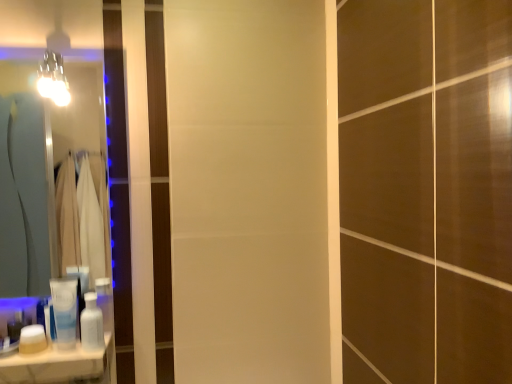
Question: Considering the relative sizes of white matte jar at lower left, marked as the first toiletry in a left-to-right arrangement, and metallic glass light fixture at upper left in the image provided, is white matte jar at lower left, marked as the first toiletry in a left-to-right arrangement, wider than metallic glass light fixture at upper left?

Choices:
 (A) no
 (B) yes

Answer: (A)

Question: Does white matte jar at lower left, marked as the first toiletry in a left-to-right arrangement, have a lesser width compared to metallic glass light fixture at upper left?

Choices:
 (A) yes
 (B) no

Answer: (A)

Question: Is white matte jar at lower left, marked as the first toiletry in a left-to-right arrangement, bigger than metallic glass light fixture at upper left?

Choices:
 (A) yes
 (B) no

Answer: (B)

Question: Considering the relative positions of white matte jar at lower left, positioned as the third toiletry in right-to-left order, and metallic glass light fixture at upper left in the image provided, is white matte jar at lower left, positioned as the third toiletry in right-to-left order, in front of metallic glass light fixture at upper left?

Choices:
 (A) yes
 (B) no

Answer: (A)

Question: From the image's perspective, does white matte jar at lower left, marked as the first toiletry in a left-to-right arrangement, appear lower than metallic glass light fixture at upper left?

Choices:
 (A) no
 (B) yes

Answer: (B)

Question: From the image's perspective, is white glossy lotion at lower left, placed as the 2th toiletry when sorted from left to right, above or below white glossy counter top at lower left?

Choices:
 (A) below
 (B) above

Answer: (B)

Question: Is point (53, 302) positioned closer to the camera than point (25, 379)?

Choices:
 (A) closer
 (B) farther

Answer: (B)

Question: Considering the relative positions of white glossy lotion at lower left, placed as the 2th toiletry when sorted from left to right, and white glossy counter top at lower left in the image provided, is white glossy lotion at lower left, placed as the 2th toiletry when sorted from left to right, to the left or to the right of white glossy counter top at lower left?

Choices:
 (A) right
 (B) left

Answer: (A)

Question: From a real-world perspective, is white glossy lotion at lower left, placed as the 2th toiletry when sorted from left to right, above or below white glossy counter top at lower left?

Choices:
 (A) below
 (B) above

Answer: (B)

Question: Considering the positions of matte glass mirror at left and metallic glass light fixture at upper left in the image, is matte glass mirror at left bigger or smaller than metallic glass light fixture at upper left?

Choices:
 (A) big
 (B) small

Answer: (A)

Question: Would you say matte glass mirror at left is inside or outside metallic glass light fixture at upper left?

Choices:
 (A) outside
 (B) inside

Answer: (A)

Question: Is matte glass mirror at left in front of or behind metallic glass light fixture at upper left in the image?

Choices:
 (A) front
 (B) behind

Answer: (B)

Question: Considering the positions of matte glass mirror at left and metallic glass light fixture at upper left in the image, is matte glass mirror at left wider or thinner than metallic glass light fixture at upper left?

Choices:
 (A) thin
 (B) wide

Answer: (A)

Question: From the image's perspective, is white glossy lotion at lower left, which is the second toiletry from right to left, above or below white matte jar at lower left, positioned as the third toiletry in right-to-left order?

Choices:
 (A) below
 (B) above

Answer: (B)

Question: Considering the positions of point (73, 336) and point (33, 327), is point (73, 336) closer or farther from the camera than point (33, 327)?

Choices:
 (A) farther
 (B) closer

Answer: (B)